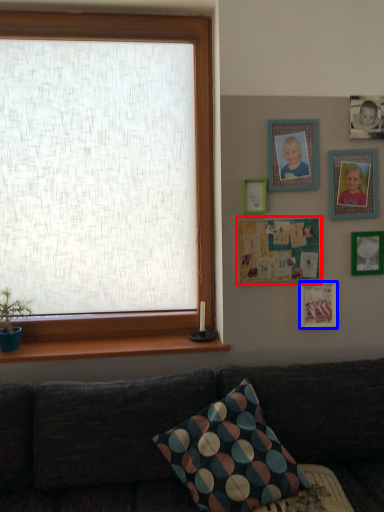
Question: Which of the following is the farthest to the observer, picture frame (highlighted by a red box) or picture frame (highlighted by a blue box)?

Choices:
 (A) picture frame
 (B) picture frame

Answer: (B)